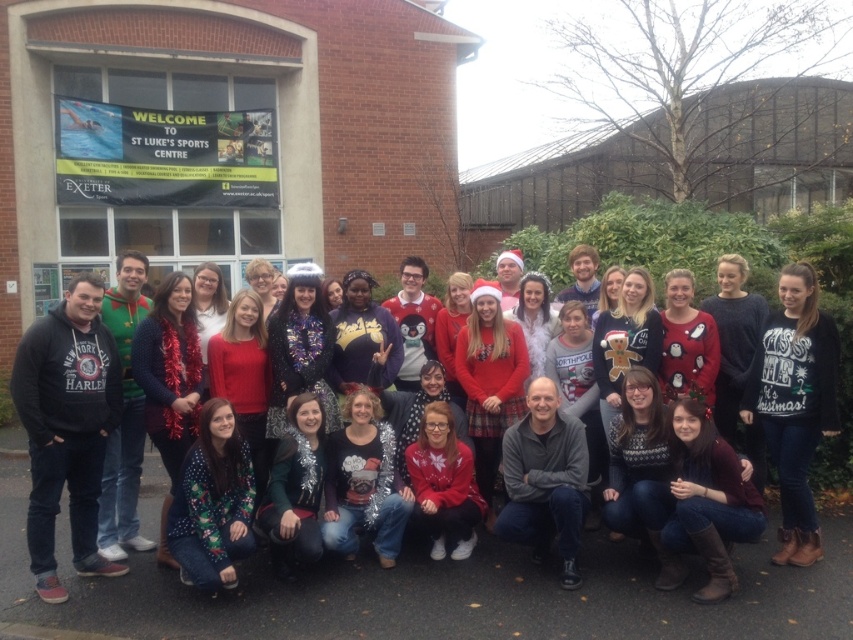
Between white sweater at center and brown leather boots at lower right, which one is positioned higher?

white sweater at center

Consider the image. Is white sweater at center to the right of brown leather boots at lower right from the viewer's perspective?

Yes, white sweater at center is to the right of brown leather boots at lower right.

Between point (817, 401) and point (712, 448), which one is positioned in front?

Point (712, 448)

This screenshot has width=853, height=640. Identify the location of white sweater at center. (793, 403).